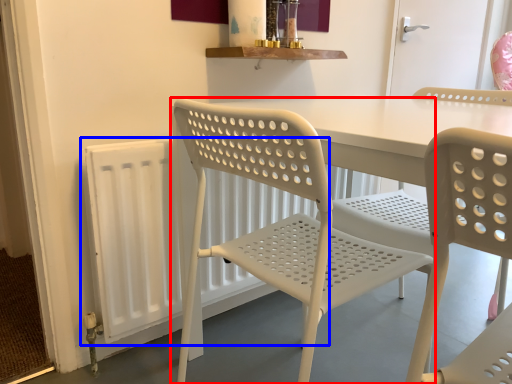
Question: Which point is further to the camera, chair (highlighted by a red box) or radiator (highlighted by a blue box)?

Choices:
 (A) chair
 (B) radiator

Answer: (B)